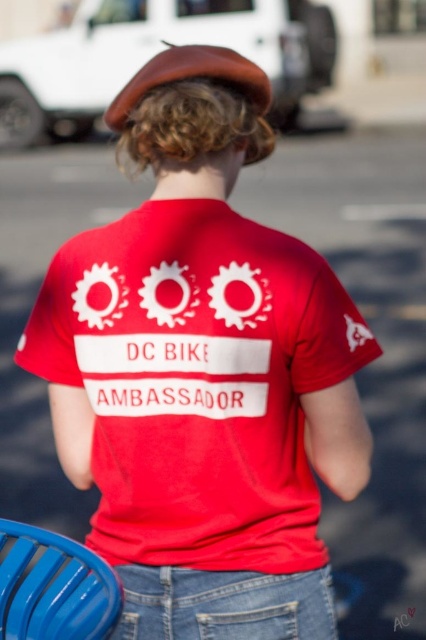
Can you confirm if matte red t-shirt at center is smaller than denim at center?

Incorrect, matte red t-shirt at center is not smaller in size than denim at center.

The width and height of the screenshot is (426, 640). Describe the element at coordinates (196, 381) in the screenshot. I see `matte red t-shirt at center` at that location.

Which is behind, point (287, 342) or point (322, 632)?

Point (322, 632)

Where is `matte red t-shirt at center`? This screenshot has height=640, width=426. matte red t-shirt at center is located at coordinates (196, 381).

Between point (285, 465) and point (51, 593), which one is positioned in front?

Point (51, 593)

What do you see at coordinates (196, 381) in the screenshot? The height and width of the screenshot is (640, 426). I see `matte red t-shirt at center` at bounding box center [196, 381].

You are a GUI agent. You are given a task and a screenshot of the screen. Output one action in this format:
    pyautogui.click(x=<x>, y=<y>)
    Task: Click on the matte red t-shirt at center
    The image size is (426, 640).
    Given the screenshot: What is the action you would take?
    pyautogui.click(x=196, y=381)

Can you confirm if denim at center is bigger than blue plastic chair at lower left?

No, denim at center is not bigger than blue plastic chair at lower left.

Who is more forward, (282, 586) or (106, 632)?

Positioned in front is point (106, 632).

At what (x,y) coordinates should I click in order to perform the action: click on denim at center. Please return your answer as a coordinate pair (x, y). The height and width of the screenshot is (640, 426). Looking at the image, I should click on (224, 604).